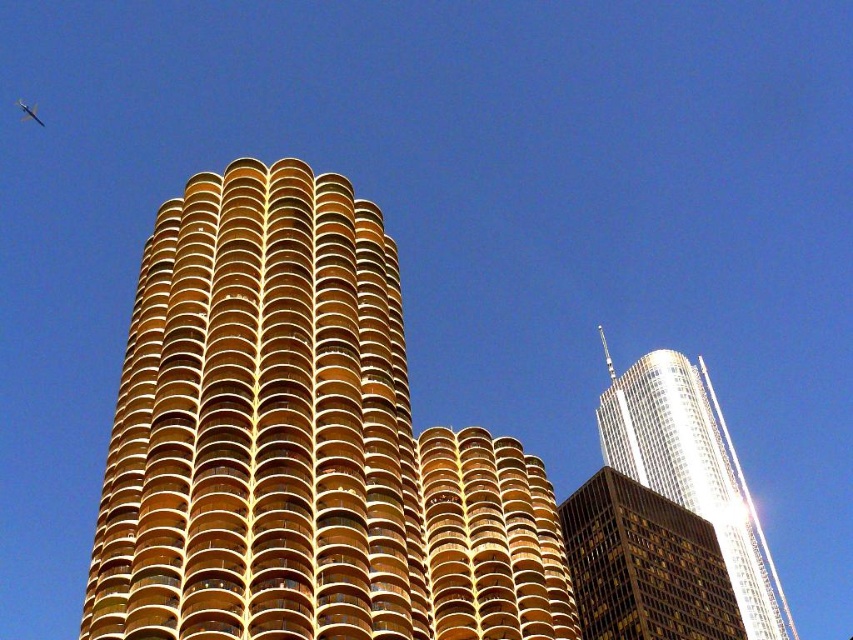
Question: Is gold glassy building at center thinner than metallic silver airplane at upper center?

Choices:
 (A) yes
 (B) no

Answer: (B)

Question: Which of the following is the farthest from the observer?

Choices:
 (A) (699, 364)
 (B) (32, 118)

Answer: (B)

Question: Does gold reflective glass skyscraper at center come behind metallic silver airplane at upper center?

Choices:
 (A) no
 (B) yes

Answer: (A)

Question: Can you confirm if gold glassy building at center is positioned above metallic silver airplane at upper center?

Choices:
 (A) yes
 (B) no

Answer: (B)

Question: Which point appears farthest from the camera in this image?

Choices:
 (A) (659, 516)
 (B) (775, 593)
 (C) (175, 419)
 (D) (22, 104)

Answer: (D)

Question: Which point is farther from the camera taking this photo?

Choices:
 (A) pos(19,100)
 (B) pos(637,564)

Answer: (A)